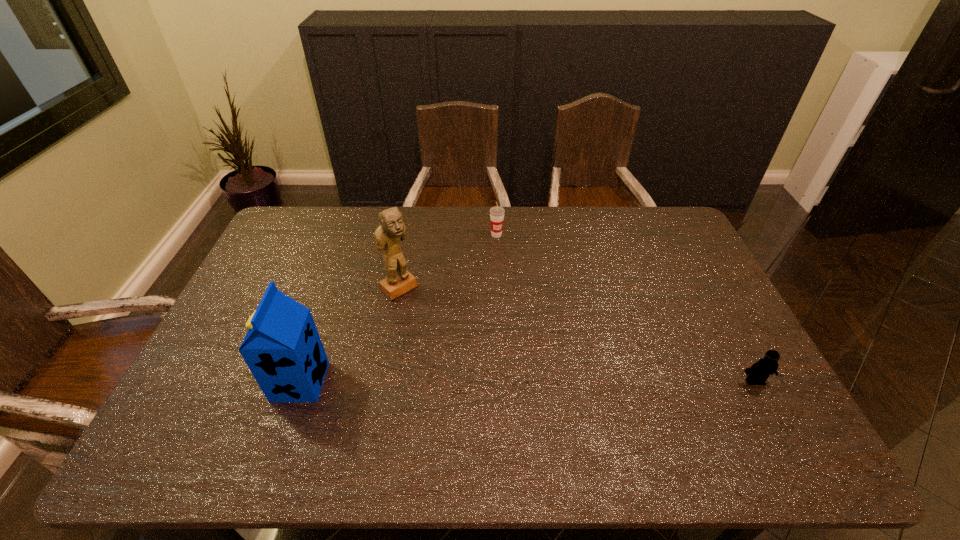
The height and width of the screenshot is (540, 960). In the image, there is a desktop. Find the location of `vacant region at the near edge`. vacant region at the near edge is located at coordinates (253, 410).

You are a GUI agent. You are given a task and a screenshot of the screen. Output one action in this format:
    pyautogui.click(x=<x>, y=<y>)
    Task: Click on the free space at the left edge of the desktop
    The height and width of the screenshot is (540, 960).
    Given the screenshot: What is the action you would take?
    pyautogui.click(x=303, y=259)

The width and height of the screenshot is (960, 540). I want to click on free spot at the right edge of the desktop, so click(x=703, y=266).

What are the coordinates of `free region at the far left corner of the desktop` in the screenshot? It's located at (324, 216).

Where is `vacant point at the near left corner`? The width and height of the screenshot is (960, 540). vacant point at the near left corner is located at coordinates (177, 419).

In the image, there is a desktop. Where is `vacant space at the far right corner`? vacant space at the far right corner is located at coordinates coord(672,224).

Where is `vacant space that is in between the second object from left to right and the second object from right to left`? vacant space that is in between the second object from left to right and the second object from right to left is located at coordinates (447, 261).

Where is `free space between the second object from left to right and the rightmost object`? The height and width of the screenshot is (540, 960). free space between the second object from left to right and the rightmost object is located at coordinates (577, 335).

Find the location of a particular element. This screenshot has width=960, height=540. free space between the third tallest object and the Lego is located at coordinates (626, 308).

Locate an element on the screen. The height and width of the screenshot is (540, 960). empty location between the third object from left to right and the rightmost object is located at coordinates (626, 308).